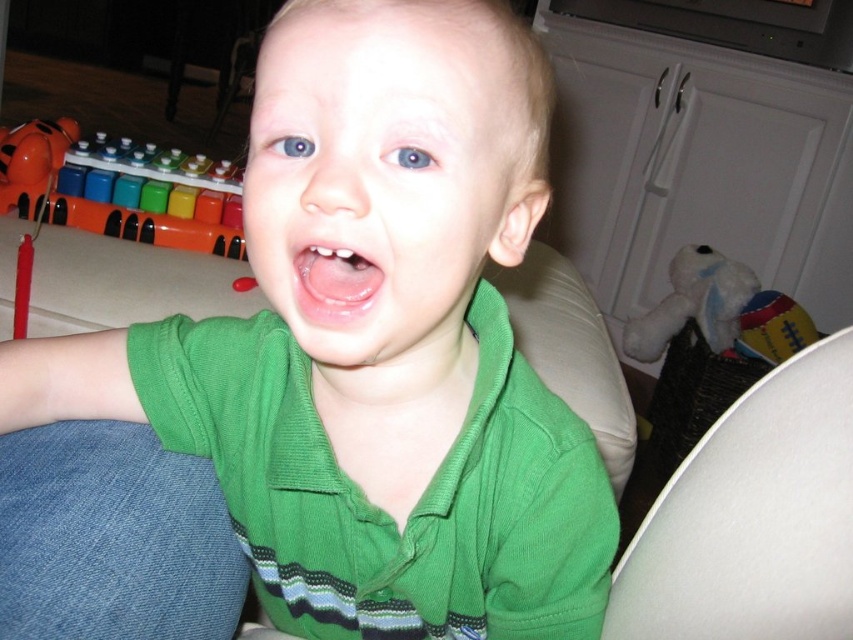
The child is wearing a green cotton shirt at center and has a blue matte eye at center. Which of these items is bigger?

The green cotton shirt at center is larger in size than the blue matte eye at center.

You are a photographer trying to capture a closeup of the child in the image. You want to focus on the green cotton shirt at center and the blue matte eye at center. Which object should you adjust your camera focus on first to ensure both are in focus?

The green cotton shirt at center is closer to the viewer than the blue matte eye at center. To ensure both are in focus, you should adjust your camera focus on the green cotton shirt at center first, as it is closer, and then the blue matte eye at center will naturally come into focus if the depth of field is sufficient.

You are a photographer trying to capture a closeup of the xylophone toy in the scene. The xylophone is located at point (339, 196). You are currently 12 inches away from the xylophone. Do you need to move closer or farther away to focus on it?

The point (339, 196) is 11.95 inches away from the viewer. Since you are currently 12 inches away, you need to move slightly closer to reach the exact distance required to focus on the xylophone toy at point (339, 196).